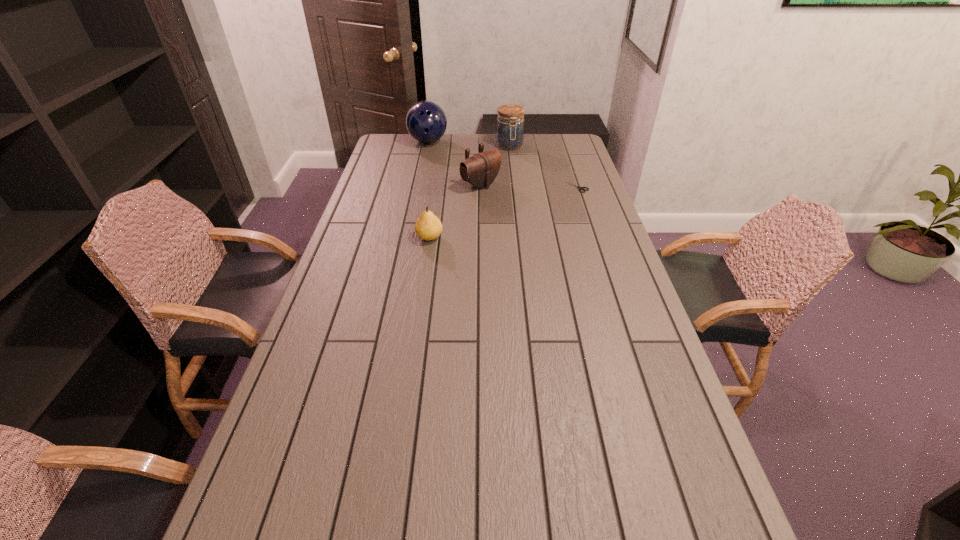
Identify the location of free region located with the flap open on the pouch. (532, 213).

The height and width of the screenshot is (540, 960). Find the location of `vacant space located with the flap open on the pouch`. vacant space located with the flap open on the pouch is located at coordinates (572, 235).

Where is `free space located on the surface of the bowling ball near the finger holes`? free space located on the surface of the bowling ball near the finger holes is located at coordinates (453, 174).

Where is `free point located on the surface of the bowling ball near the finger holes`? This screenshot has width=960, height=540. free point located on the surface of the bowling ball near the finger holes is located at coordinates (440, 157).

This screenshot has width=960, height=540. I want to click on free location located 0.160m on the surface of the bowling ball near the finger holes, so click(x=446, y=165).

Where is `vacant space located on the lid of the jar`? vacant space located on the lid of the jar is located at coordinates [514, 158].

Image resolution: width=960 pixels, height=540 pixels. In order to click on free region located 0.210m on the lid of the jar in this screenshot , I will do `click(519, 175)`.

Locate an element on the screen. The height and width of the screenshot is (540, 960). vacant space located 0.160m on the lid of the jar is located at coordinates (517, 170).

Where is `bowling ball that is at the far edge`? bowling ball that is at the far edge is located at coordinates (426, 122).

The width and height of the screenshot is (960, 540). I want to click on jar that is at the far edge, so click(510, 130).